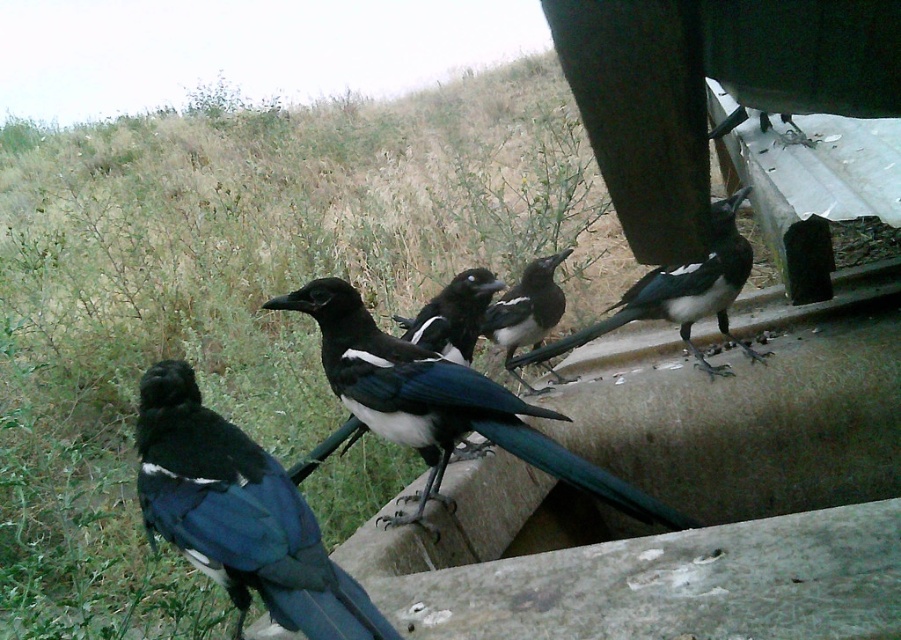
You are a photographer trying to capture a closeup of the wooden structure where the magpies are perched. You notice two points on the structure labeled as point (479, 384) and point (733, 296). Which point should you focus on to get a clearer image of the structure?

You should focus on point (479, 384) because it is closer to the camera than point (733, 296), making it easier to capture a clear closeup.